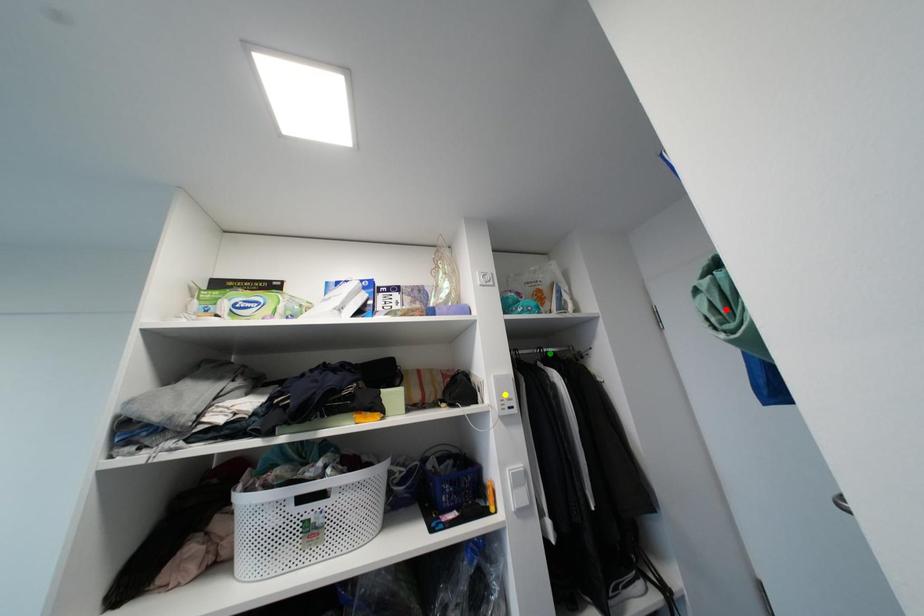
Order these from nearest to farthest:
- green point
- yellow point
- red point

red point < yellow point < green point